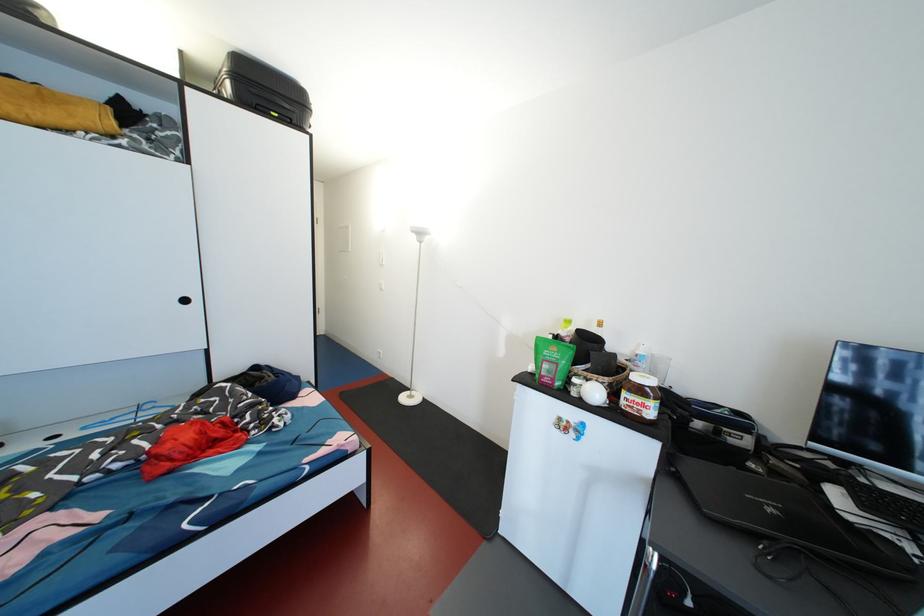
The height and width of the screenshot is (616, 924). What do you see at coordinates (759, 554) in the screenshot?
I see `the chair sitting surface` at bounding box center [759, 554].